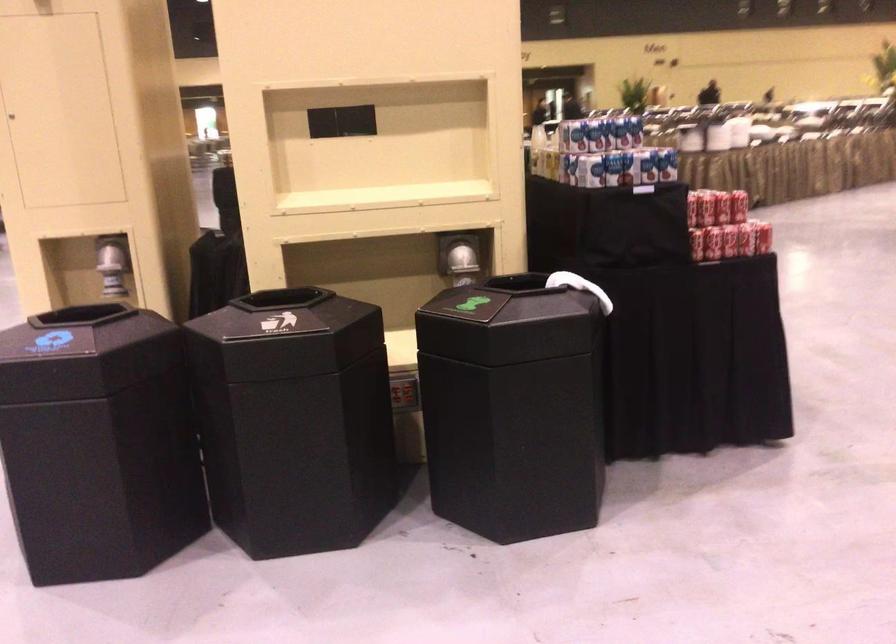
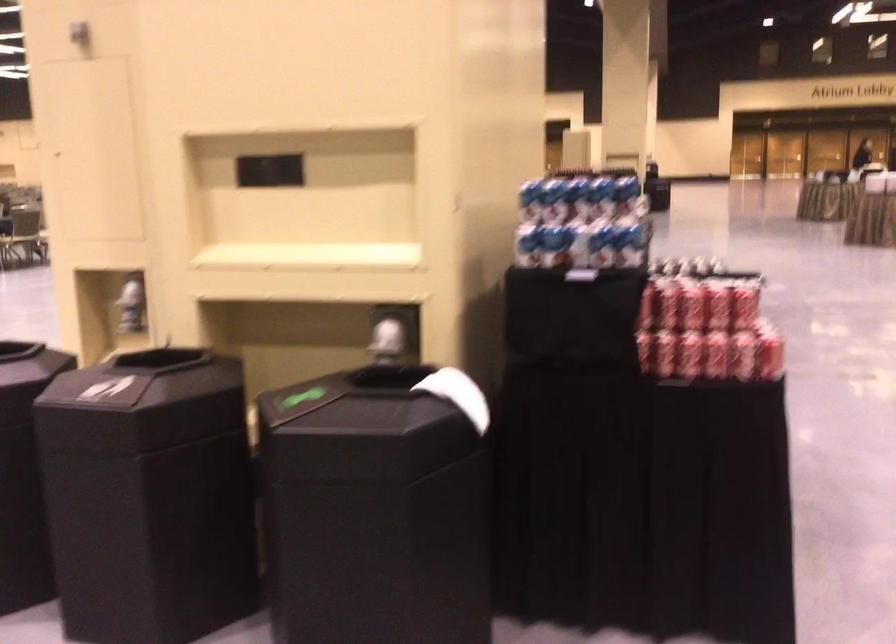
Find the pixel in the second image that matches (x=719, y=243) in the first image.

(688, 355)